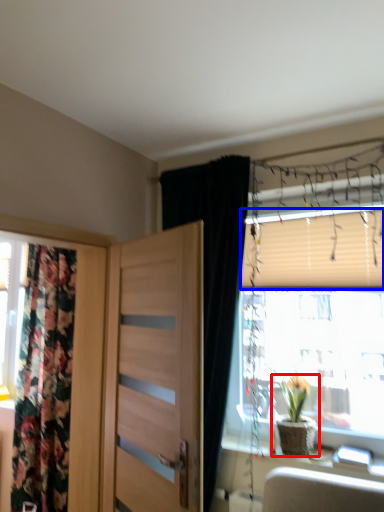
Question: Which of the following is the farthest to the observer, houseplant (highlighted by a red box) or blind (highlighted by a blue box)?

Choices:
 (A) houseplant
 (B) blind

Answer: (B)